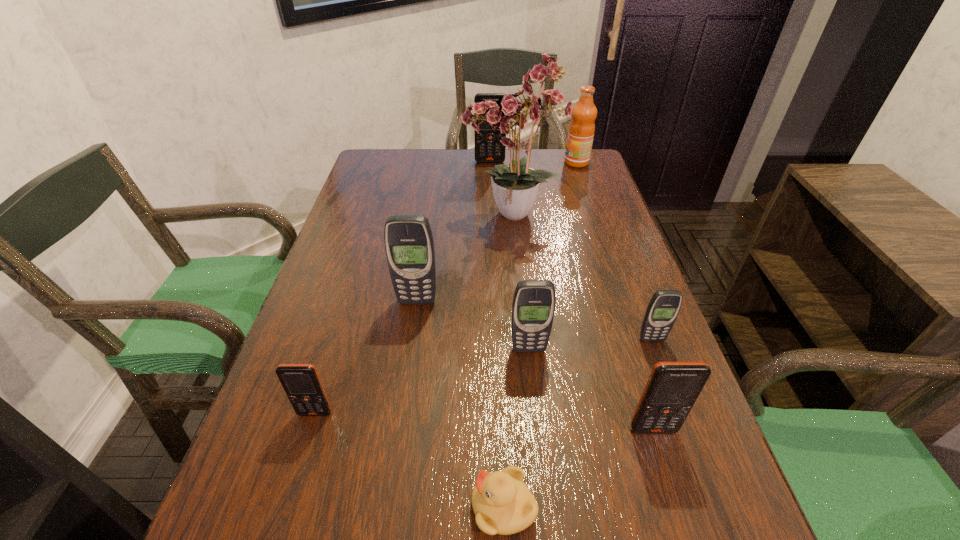
Where is `the second nearest object`? This screenshot has width=960, height=540. the second nearest object is located at coordinates (672, 389).

You are a GUI agent. You are given a task and a screenshot of the screen. Output one action in this format:
    pyautogui.click(x=<x>, y=<y>)
    Task: Click on the leftmost object
    This screenshot has width=960, height=540.
    Given the screenshot: What is the action you would take?
    pyautogui.click(x=301, y=382)

In order to click on the leftmost cellular telephone in this screenshot , I will do point(301,382).

At what (x,y) coordinates should I click in order to perform the action: click on the second farthest gray cellular telephone. Please return your answer as a coordinate pair (x, y). Looking at the image, I should click on (664, 306).

Where is `the smallest gray cellular telephone`? This screenshot has width=960, height=540. the smallest gray cellular telephone is located at coordinates (664, 306).

The width and height of the screenshot is (960, 540). Find the location of `blank area located on the front-facing side of the seventh nearest object`. blank area located on the front-facing side of the seventh nearest object is located at coordinates (435, 216).

Where is `free space located on the front-facing side of the seventh nearest object`? free space located on the front-facing side of the seventh nearest object is located at coordinates (418, 216).

At what (x,y) coordinates should I click in order to perform the action: click on vacant region located 0.310m on the front-facing side of the seventh nearest object. Please return your answer as a coordinate pair (x, y). This screenshot has width=960, height=540. Looking at the image, I should click on (346, 216).

The width and height of the screenshot is (960, 540). Find the location of `vacant area situated on the label side of the fruit juice`. vacant area situated on the label side of the fruit juice is located at coordinates click(x=510, y=163).

Find the location of `vacant area located 0.090m on the label side of the fruit juice`. vacant area located 0.090m on the label side of the fruit juice is located at coordinates pos(537,163).